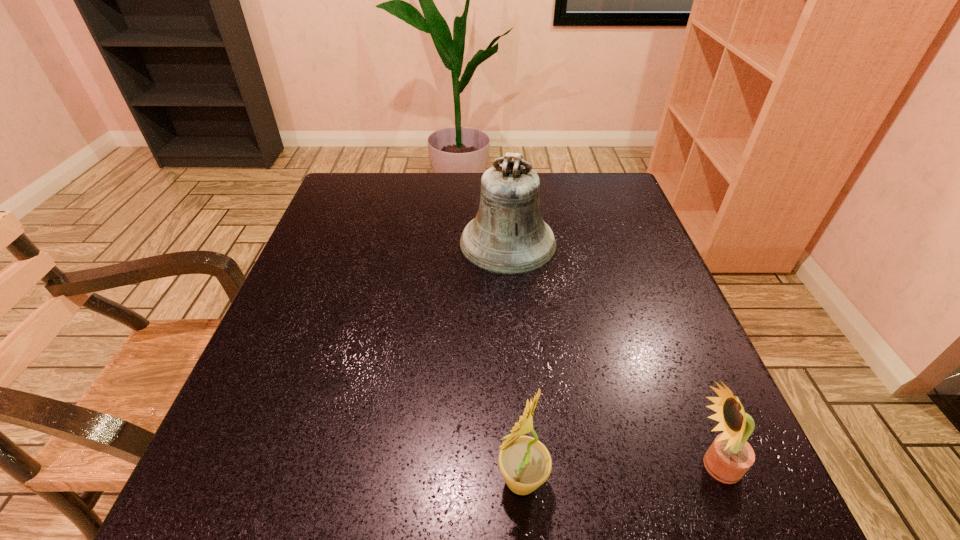
Locate an element on the screen. object that can be found as the closest to the farthest object is located at coordinates (730, 456).

The height and width of the screenshot is (540, 960). Find the location of `free space that satisfies the following two spatial constraints: 1. on the front side of the bell; 2. on the face of the left sunflower`. free space that satisfies the following two spatial constraints: 1. on the front side of the bell; 2. on the face of the left sunflower is located at coordinates (526, 480).